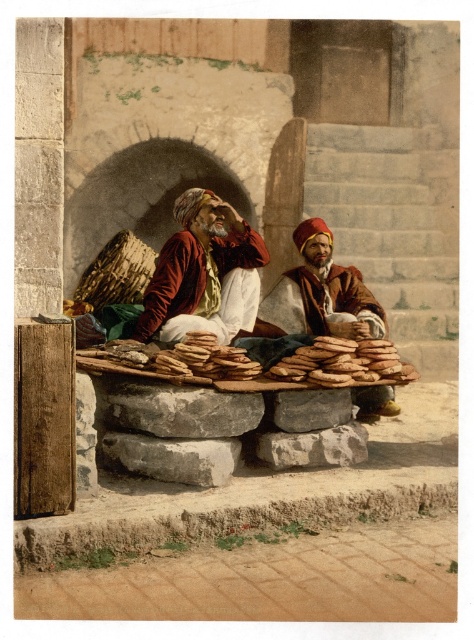
Which is in front, point (263, 259) or point (390, 388)?

Positioned in front is point (390, 388).

Image resolution: width=474 pixels, height=640 pixels. Identify the location of matte red turban at center. (203, 273).